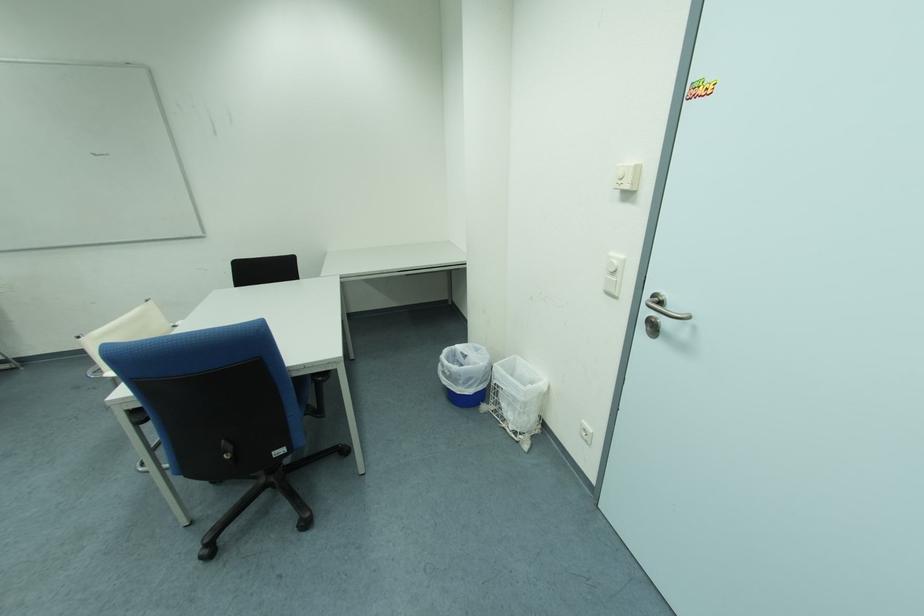
Where would you pull the metal door handle? Please return your answer as a coordinate pair (x, y).

(663, 307)